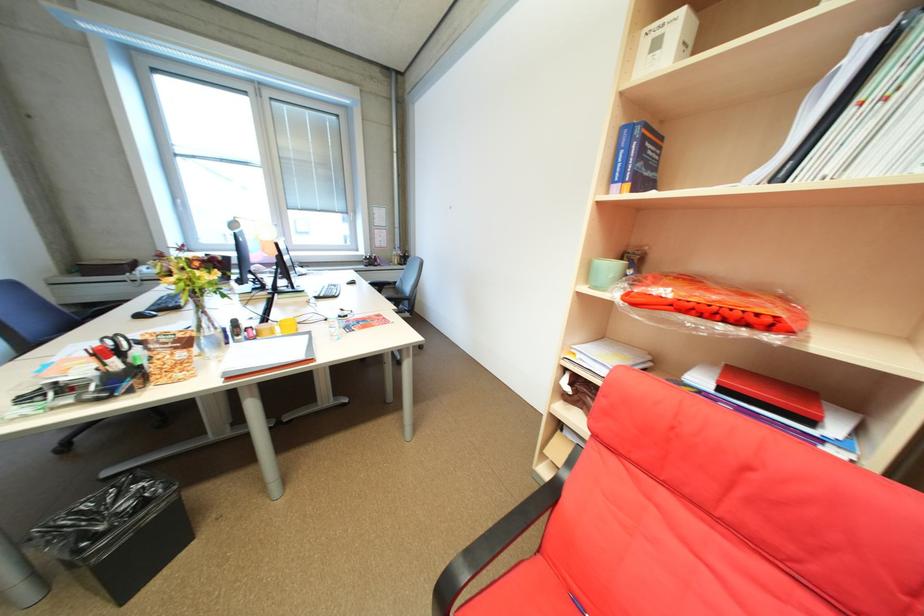
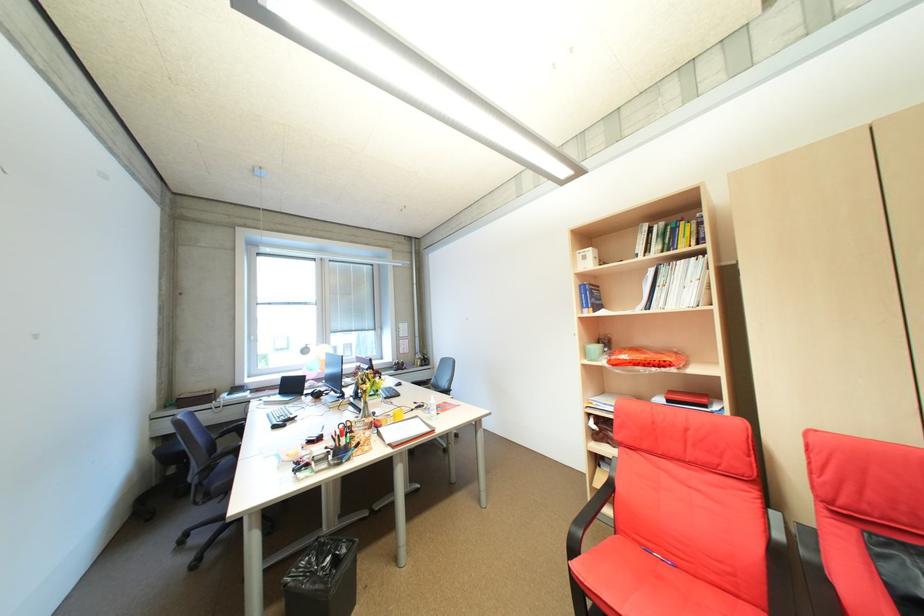
Locate, in the second image, the point that corresponds to (589,357) in the first image.

(603, 403)